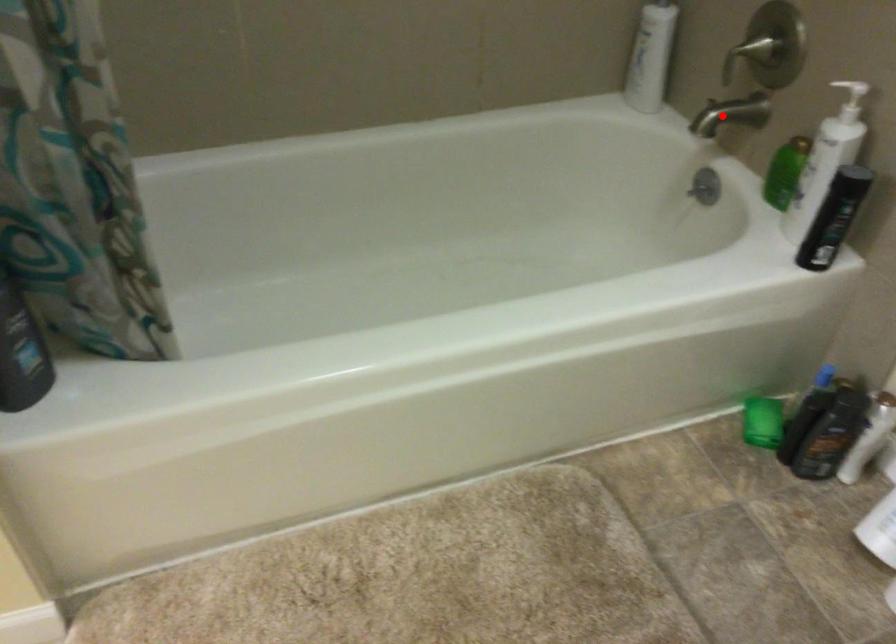
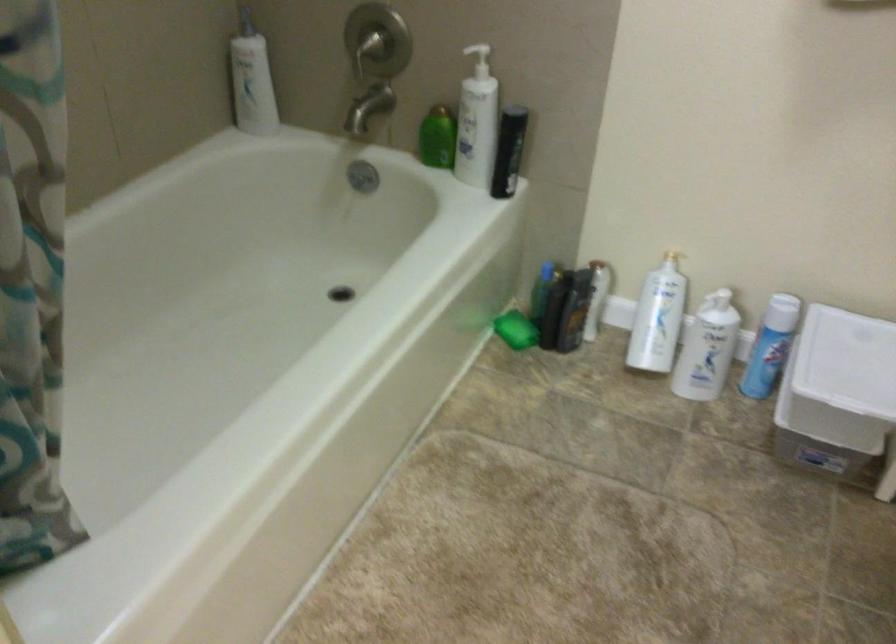
Question: I am providing you with two images of the same scene from different viewpoints. Image1 has a red point marked. In image2, the corresponding 3D location appears at what relative position? Reply with the corresponding letter.

Choices:
 (A) Closer
 (B) Farther

Answer: (B)